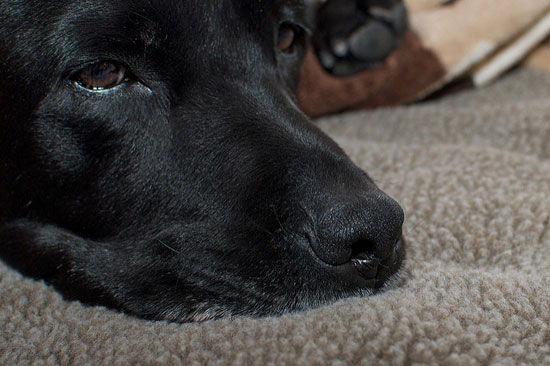
Locate an element on the screen. brown and beige blanket is located at coordinates (397, 82), (462, 32).